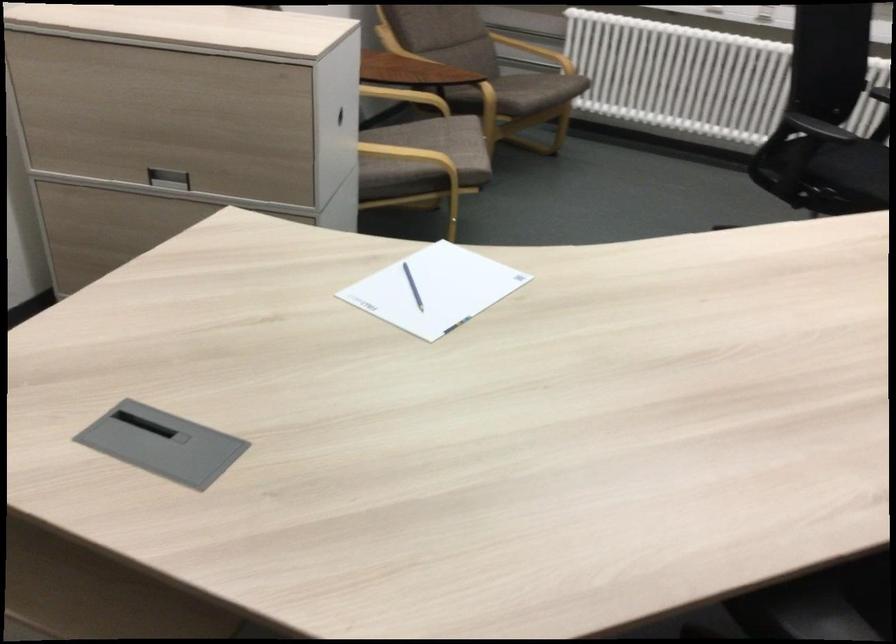
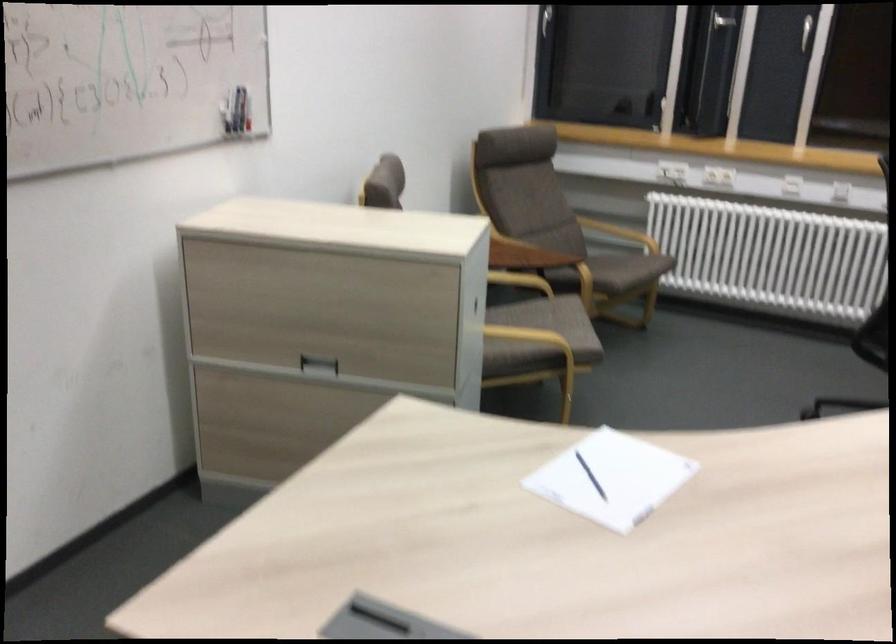
Locate, in the second image, the point that corresponds to point 419,287 in the first image.

(590, 476)